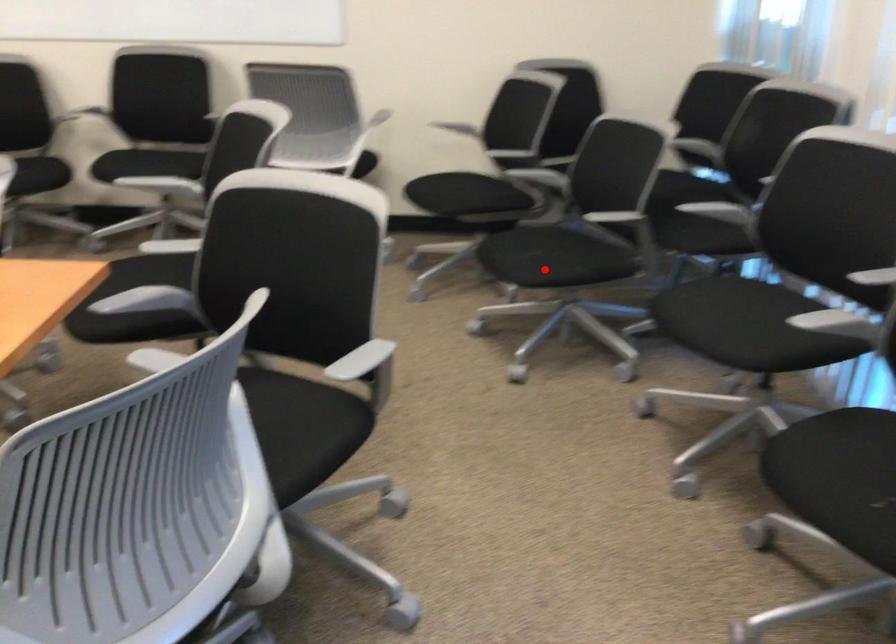
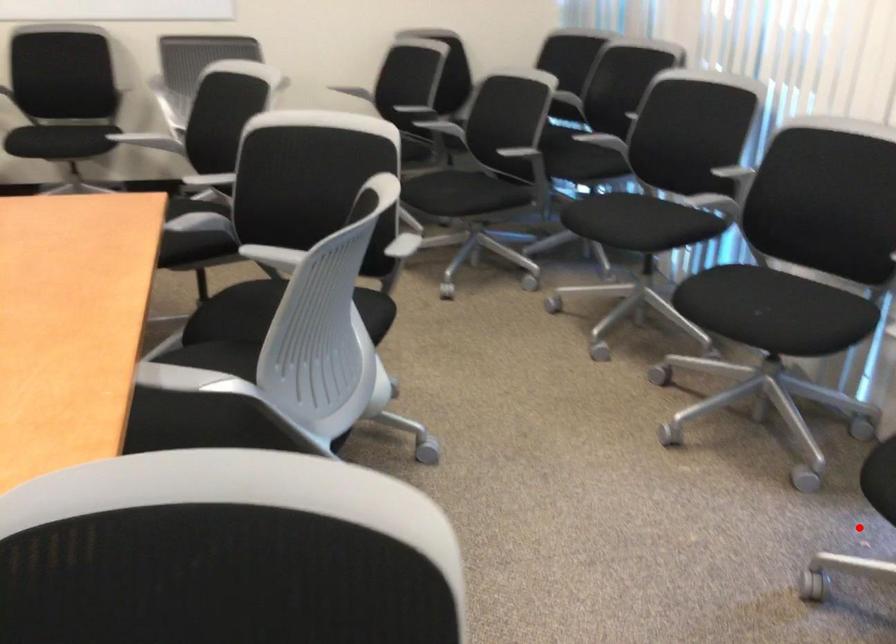
I am providing you with two images of the same scene from different viewpoints. A red point is marked on the first image and another point is marked on the second image. Is the red point in image1 aligned with the point shown in image2?

No